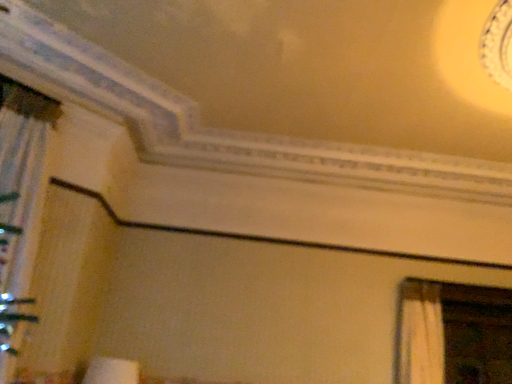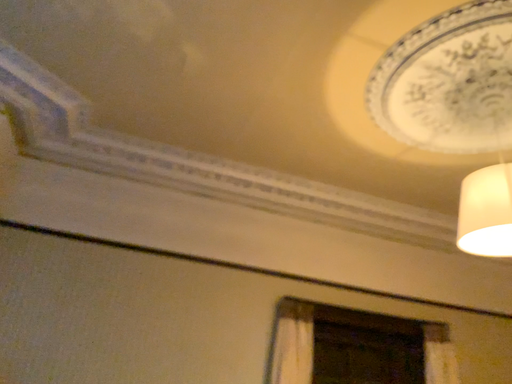
Question: How did the camera likely rotate when shooting the video?

Choices:
 (A) rotated right
 (B) rotated left

Answer: (A)